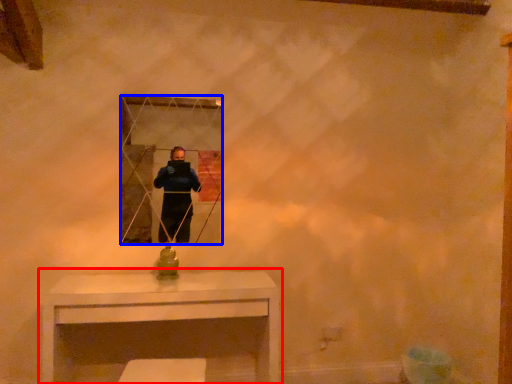
Question: Which of the following is the closest to the observer, table (highlighted by a red box) or mirror (highlighted by a blue box)?

Choices:
 (A) table
 (B) mirror

Answer: (A)